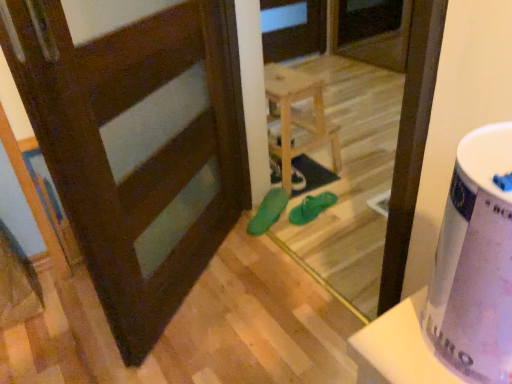
In order to click on vacant space in front of dark brown wood door at center in this screenshot , I will do point(214,339).